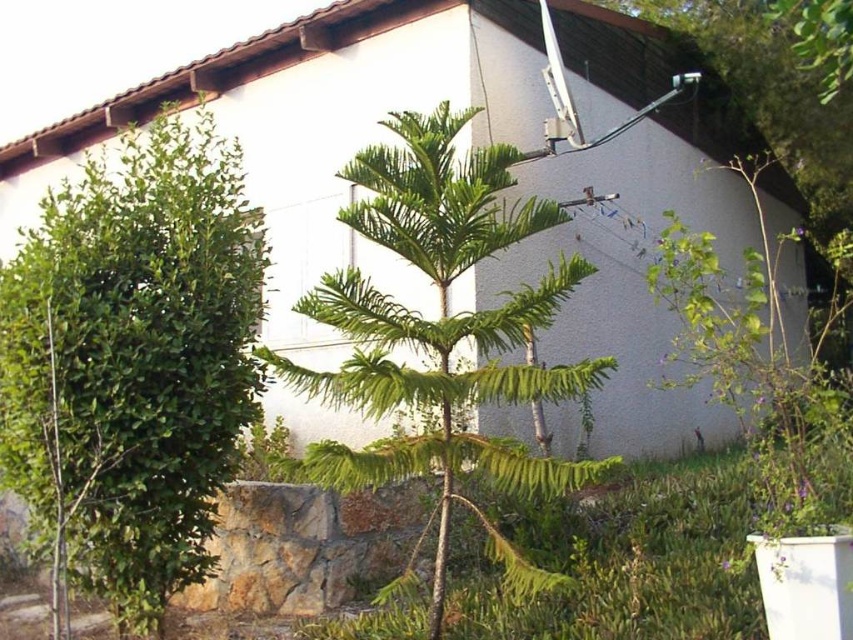
You are a gardener trying to plant a new flower bed between the green leafy shrub at left and the green leafy palm tree at center. The flower bed needs to be 1.2 meters wide. Can you fit it between them?

The green leafy shrub at left has a lesser width compared to the green leafy palm tree at center. However, the description does not provide the exact distance between them, so it is unclear if the 1.2 meter flower bed can fit. Additional measurements are needed.

You are standing at the point marked by the coordinates point (132, 362). Looking towards the tree in the foreground, which direction should you move to reach the tree?

The green leafy shrub at left is represented by point (132, 362). Since the tree is in the foreground and the shrub is at the left, you should move towards the center to reach the tree.

You are standing in the garden and want to walk from the green leafy shrub at left to the green leafy palm tree at center. Which direction should you move to get closer to the palm tree?

You should move towards the green leafy palm tree at center by walking away from the green leafy shrub at left since the shrub is closer to you than the palm tree.